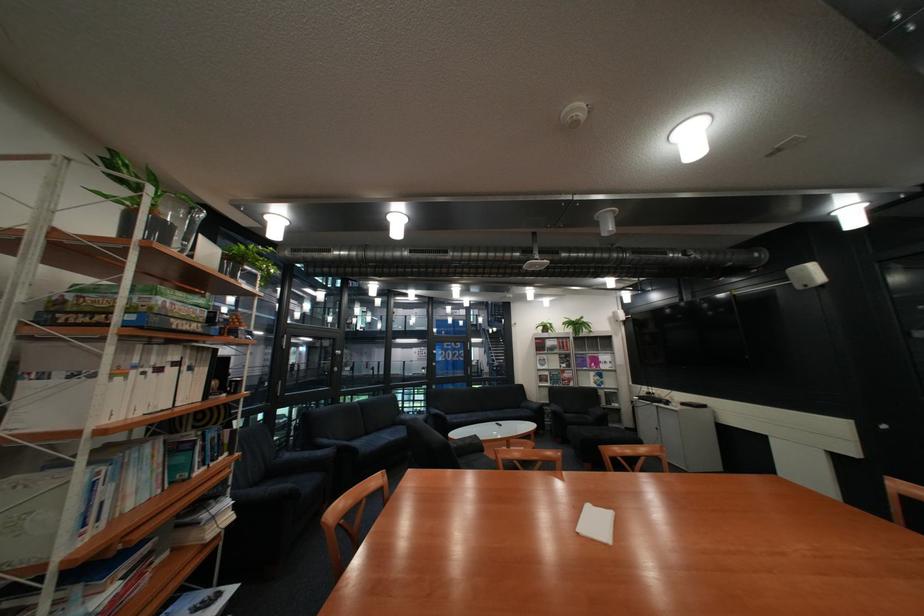
What do you see at coordinates (344, 361) in the screenshot?
I see `the glass window handle` at bounding box center [344, 361].